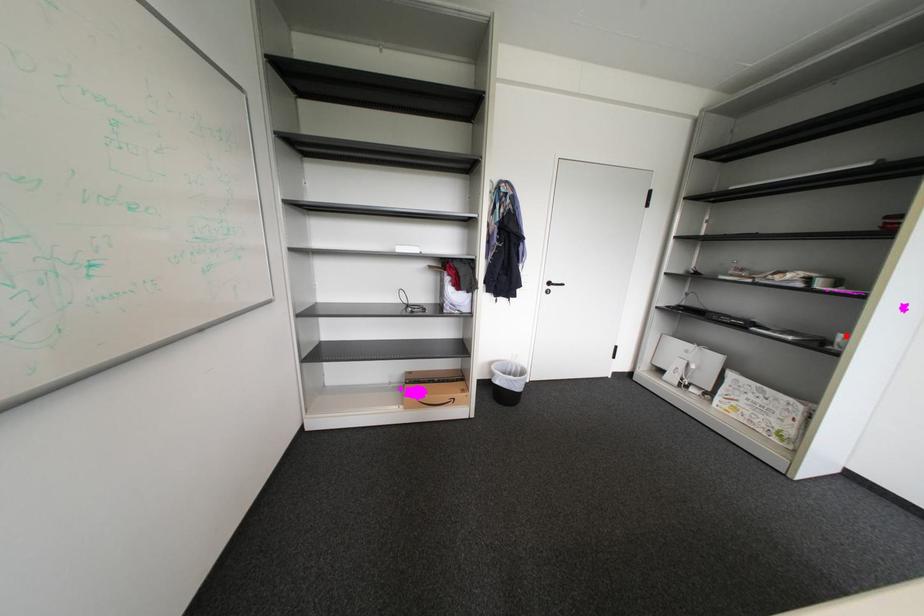
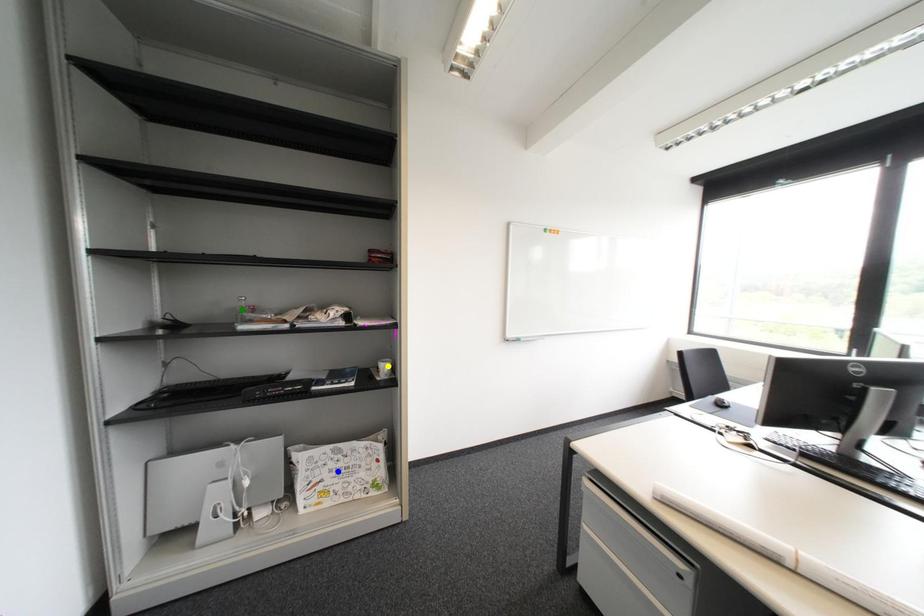
Question: I am providing you with two images of the same scene from different viewpoints. A red point is marked on the first image. You are given multiple points on the second image. In image 2, which mark is for the same physical point as the one in image 1?

Choices:
 (A) blue point
 (B) yellow point
 (C) green point

Answer: (B)